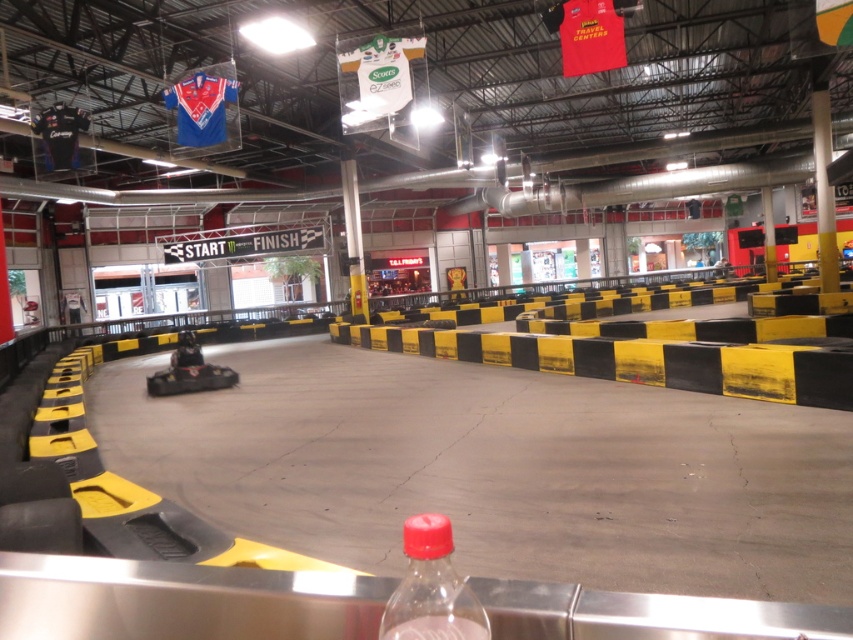
Can you confirm if yellow/black striped race track at center is bigger than clear plastic bottle at lower center?

Yes, yellow/black striped race track at center is bigger than clear plastic bottle at lower center.

Does yellow/black striped race track at center have a smaller size compared to clear plastic bottle at lower center?

Incorrect, yellow/black striped race track at center is not smaller in size than clear plastic bottle at lower center.

Locate an element on the screen. The image size is (853, 640). yellow/black striped race track at center is located at coordinates (496, 468).

Identify the location of yellow/black striped race track at center. This screenshot has width=853, height=640. (496, 468).